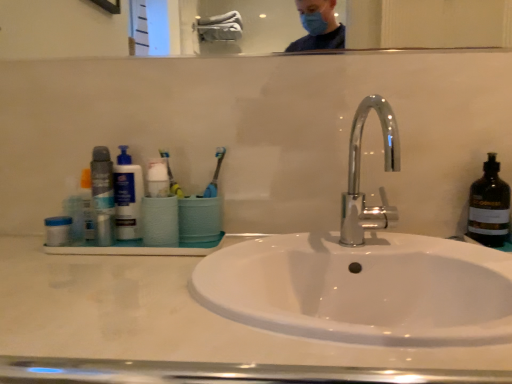
Where is `vacant space positioned to the left of blue plastic container at left`? vacant space positioned to the left of blue plastic container at left is located at coordinates pos(20,243).